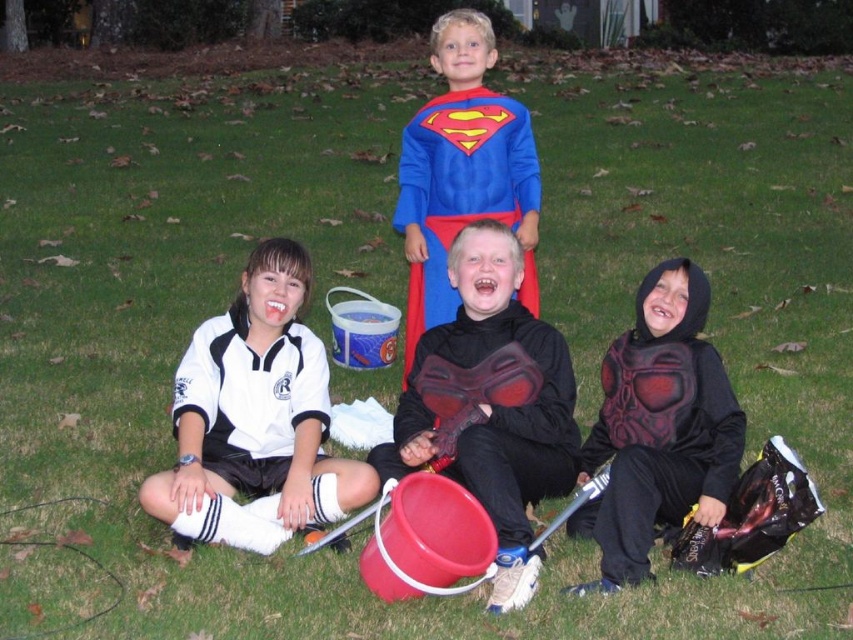
You are a photographer trying to capture a group photo of the white jersey at center and the black matte costume at lower right. Which costume should you focus on first if you want to ensure the larger one is in sharp focus?

The white jersey at center is larger in size compared to the black matte costume at lower right, so you should focus on the white jersey at center first to ensure it is in sharp focus.

You are a child in the group and want to pick up the rubberized black shield at center. Based on your current position, can you reach it without moving your feet?

The rubberized black shield at center is located at point [490,403], which is within reach if you are positioned centrally. Since you are part of the group seated around it, you can likely reach it without moving your feet.